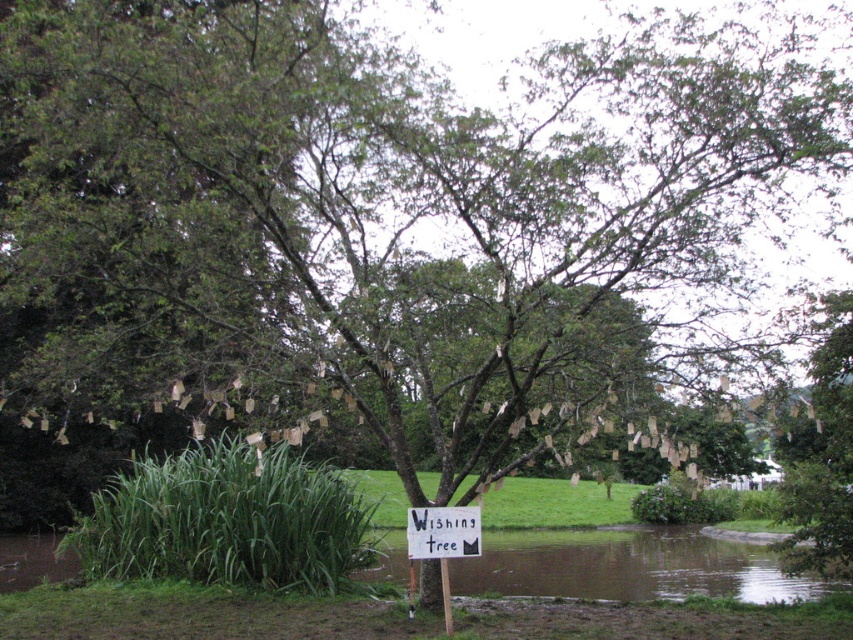
Question: Which object is positioned farthest from the white paper sign at center?

Choices:
 (A) brown murky water at lower center
 (B) green leafy tree at upper right

Answer: (A)

Question: Which point is closer to the camera taking this photo?

Choices:
 (A) (828, 467)
 (B) (399, 528)

Answer: (A)

Question: Estimate the real-world distances between objects in this image. Which object is closer to the brown murky water at lower center?

Choices:
 (A) green leafy tree at upper right
 (B) white paper sign at center

Answer: (A)

Question: In this image, where is green leafy tree at upper right located relative to white paper sign at center?

Choices:
 (A) right
 (B) left

Answer: (A)

Question: Does green leafy tree at upper right have a greater width compared to white paper sign at center?

Choices:
 (A) yes
 (B) no

Answer: (A)

Question: Is brown murky water at lower center above green leafy tree at upper right?

Choices:
 (A) no
 (B) yes

Answer: (A)